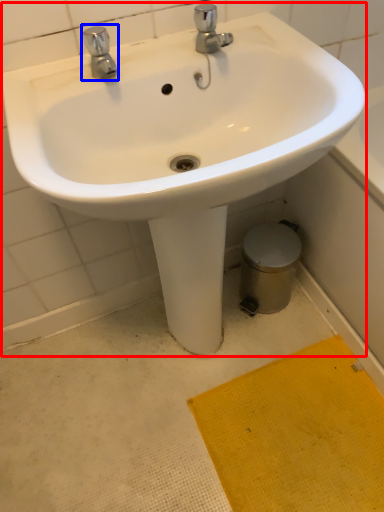
Question: Which object is closer to the camera taking this photo, sink (highlighted by a red box) or tap (highlighted by a blue box)?

Choices:
 (A) sink
 (B) tap

Answer: (A)